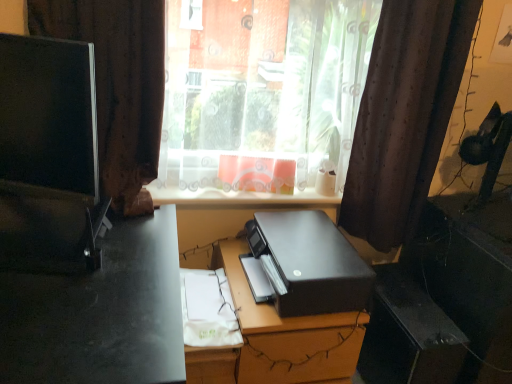
Question: Is black plastic file cabinet at center with brown fabric curtain at left, which appears as the 1th curtain when viewed from the left?

Choices:
 (A) yes
 (B) no

Answer: (B)

Question: Can you confirm if black plastic file cabinet at center is shorter than brown fabric curtain at left, the second curtain positioned from the right?

Choices:
 (A) yes
 (B) no

Answer: (A)

Question: Is the position of black plastic file cabinet at center less distant than that of brown fabric curtain at left, the second curtain positioned from the right?

Choices:
 (A) no
 (B) yes

Answer: (A)

Question: Does black plastic file cabinet at center turn towards brown fabric curtain at left, the second curtain positioned from the right?

Choices:
 (A) yes
 (B) no

Answer: (B)

Question: Is black plastic file cabinet at center located outside brown fabric curtain at left, the second curtain positioned from the right?

Choices:
 (A) yes
 (B) no

Answer: (A)

Question: Do you think brown fabric curtain at left, which appears as the 1th curtain when viewed from the left, is within matte black monitor at left, or outside of it?

Choices:
 (A) inside
 (B) outside

Answer: (B)

Question: Considering the positions of brown fabric curtain at left, which appears as the 1th curtain when viewed from the left, and matte black monitor at left in the image, is brown fabric curtain at left, which appears as the 1th curtain when viewed from the left, taller or shorter than matte black monitor at left?

Choices:
 (A) tall
 (B) short

Answer: (A)

Question: Does point (157, 135) appear closer or farther from the camera than point (15, 84)?

Choices:
 (A) farther
 (B) closer

Answer: (A)

Question: Visually, is brown fabric curtain at left, which appears as the 1th curtain when viewed from the left, positioned to the left or to the right of matte black monitor at left?

Choices:
 (A) right
 (B) left

Answer: (A)

Question: From the image's perspective, is black matte printer at center positioned above or below brown fabric curtain at left, the second curtain positioned from the right?

Choices:
 (A) below
 (B) above

Answer: (A)

Question: In terms of height, does black matte printer at center look taller or shorter compared to brown fabric curtain at left, the second curtain positioned from the right?

Choices:
 (A) tall
 (B) short

Answer: (B)

Question: Is black matte printer at center spatially inside brown fabric curtain at left, which appears as the 1th curtain when viewed from the left, or outside of it?

Choices:
 (A) inside
 (B) outside

Answer: (B)

Question: Is point (302, 316) closer or farther from the camera than point (145, 206)?

Choices:
 (A) farther
 (B) closer

Answer: (B)

Question: From the image's perspective, is black matte printer at center positioned above or below transparent plastic window at center?

Choices:
 (A) above
 (B) below

Answer: (B)

Question: Is black matte printer at center in front of or behind transparent plastic window at center in the image?

Choices:
 (A) behind
 (B) front

Answer: (B)